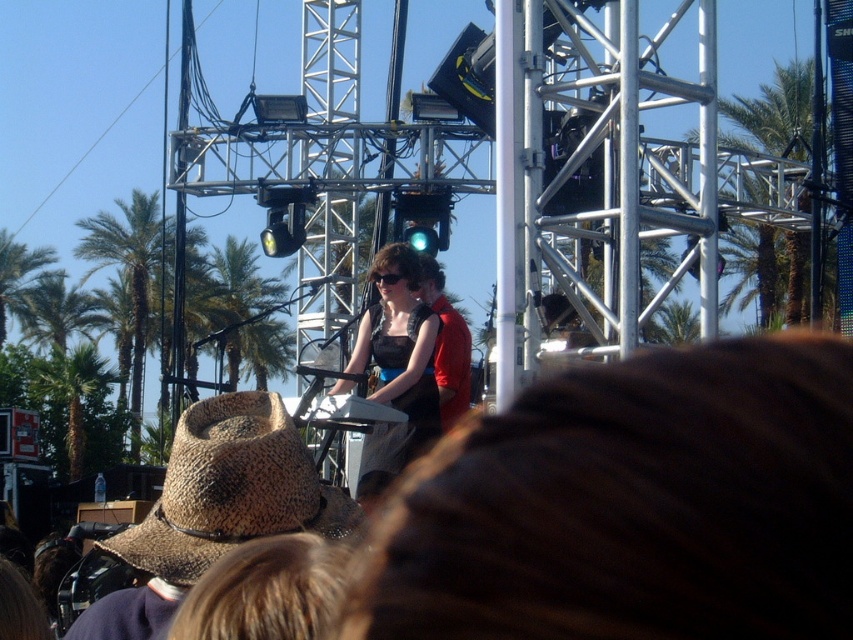
You are standing at the center of the concert stage. There is a brown woven cowboy hat at lower left located at point (231, 490). Which direction should you move to reach it?

The brown woven cowboy hat at lower left is located at point (231, 490), so you should move towards the lower left direction to reach it.

In the concert scene, there is a point at coordinates (398,365). Which object from the list is located at this point? The options are the keyboard player in black sleeveless top at midground left and the red dress performer at midground right.

The point at coordinates (398,365) is located on the matte black dress at center, so the keyboard player in black sleeveless top at midground left is the closest object to this point.